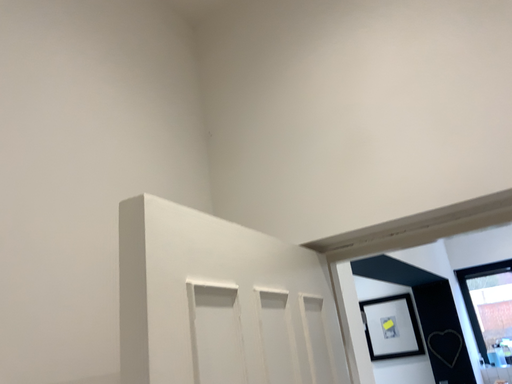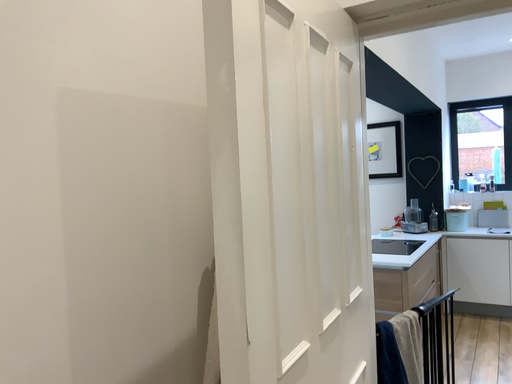
Question: Which way did the camera rotate in the video?

Choices:
 (A) rotated upward
 (B) rotated downward

Answer: (B)